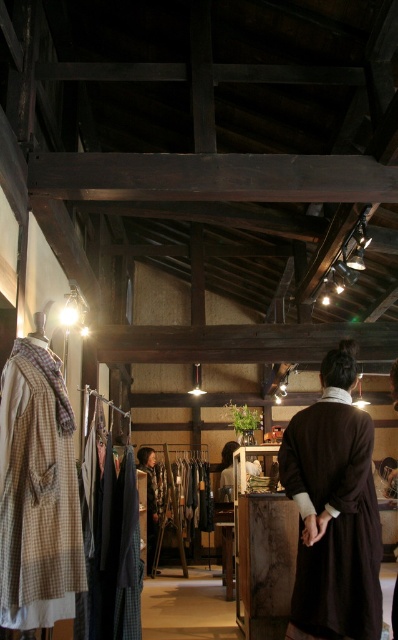
Question: From the image, what is the correct spatial relationship of brown woolen robe at right in relation to brown woolen coat at left?

Choices:
 (A) above
 (B) below

Answer: (B)

Question: Estimate the real-world distances between objects in this image. Which object is closer to the brown woolen coat at left?

Choices:
 (A) brown woolen robe at right
 (B) brown wool coat at center

Answer: (A)

Question: Is brown woolen robe at right below brown woolen coat at left?

Choices:
 (A) no
 (B) yes

Answer: (B)

Question: Estimate the real-world distances between objects in this image. Which object is closer to the matte brown coat at center?

Choices:
 (A) brown woolen coat at left
 (B) brown woolen robe at right
 (C) brown wool coat at center

Answer: (C)

Question: Which point is closer to the camera?

Choices:
 (A) (220, 460)
 (B) (40, 371)
 (C) (144, 451)

Answer: (B)

Question: Can you confirm if brown woolen robe at right is wider than brown woolen coat at left?

Choices:
 (A) no
 (B) yes

Answer: (B)